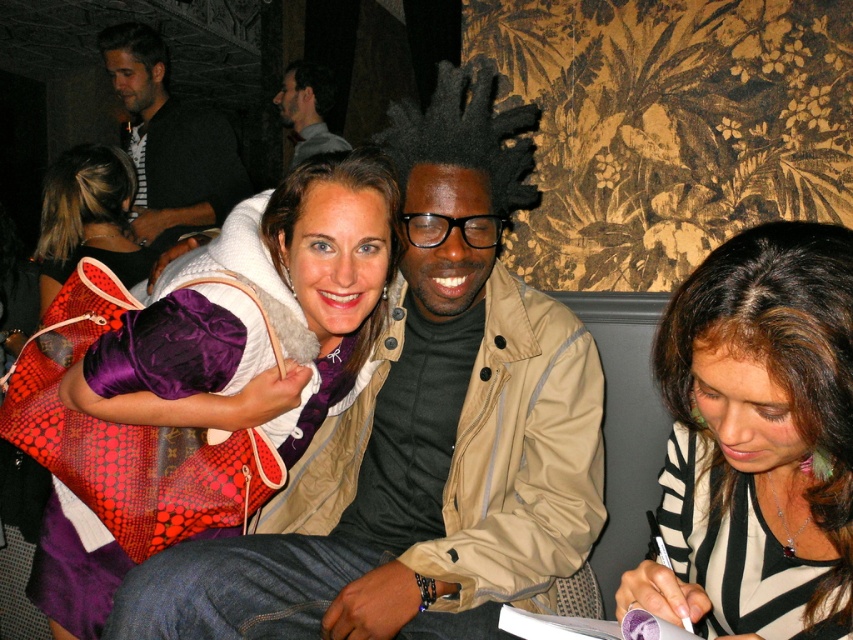
Question: Can you confirm if purple velvet bag at center is positioned above gray sweater at upper left?

Choices:
 (A) yes
 (B) no

Answer: (B)

Question: Does striped fabric shirt at lower right appear on the left side of purple velvet bag at center?

Choices:
 (A) yes
 (B) no

Answer: (B)

Question: Which point is farther from the camera taking this photo?

Choices:
 (A) (213, 115)
 (B) (705, 404)

Answer: (A)

Question: From the image, what is the correct spatial relationship of matte beige jacket at center in relation to matte purple fabric at left?

Choices:
 (A) right
 (B) left

Answer: (A)

Question: Which of the following is the closest to the observer?

Choices:
 (A) matte purple fabric at left
 (B) matte beige jacket at center

Answer: (B)

Question: Which point is farther from the camera taking this photo?

Choices:
 (A) (708, 368)
 (B) (213, 141)

Answer: (B)